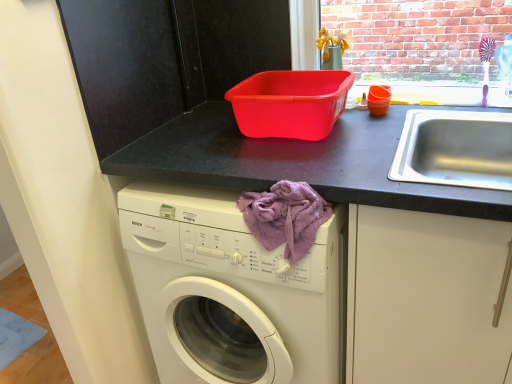
Question: Relative to matte black counter at upper center, is purple fabric at lower center in front or behind?

Choices:
 (A) behind
 (B) front

Answer: (A)

Question: Is purple fabric at lower center to the left or to the right of matte black counter at upper center in the image?

Choices:
 (A) right
 (B) left

Answer: (A)

Question: Is purple fabric at lower center wider or thinner than matte black counter at upper center?

Choices:
 (A) wide
 (B) thin

Answer: (B)

Question: Relative to purple fabric at lower center, is matte black counter at upper center in front or behind?

Choices:
 (A) behind
 (B) front

Answer: (B)

Question: Based on their sizes in the image, would you say matte black counter at upper center is bigger or smaller than purple fabric at lower center?

Choices:
 (A) big
 (B) small

Answer: (A)

Question: Considering the positions of matte black counter at upper center and purple fabric at lower center in the image, is matte black counter at upper center taller or shorter than purple fabric at lower center?

Choices:
 (A) tall
 (B) short

Answer: (A)

Question: Is point (471, 370) closer or farther from the camera than point (284, 213)?

Choices:
 (A) closer
 (B) farther

Answer: (B)